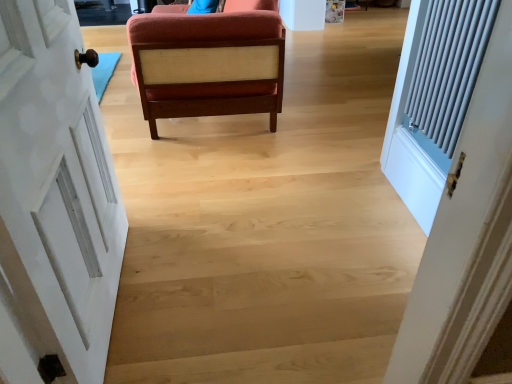
Question: Considering the relative sizes of velvet orange chair at center and white painted wood door at left in the image provided, is velvet orange chair at center thinner than white painted wood door at left?

Choices:
 (A) no
 (B) yes

Answer: (A)

Question: Considering the relative sizes of velvet orange chair at center and white painted wood door at left in the image provided, is velvet orange chair at center shorter than white painted wood door at left?

Choices:
 (A) no
 (B) yes

Answer: (B)

Question: From a real-world perspective, is velvet orange chair at center located higher than white painted wood door at left?

Choices:
 (A) no
 (B) yes

Answer: (A)

Question: Does velvet orange chair at center appear on the right side of white painted wood door at left?

Choices:
 (A) no
 (B) yes

Answer: (B)

Question: Are velvet orange chair at center and white painted wood door at left located far from each other?

Choices:
 (A) yes
 (B) no

Answer: (B)

Question: Does velvet orange chair at center lie in front of white painted wood door at left?

Choices:
 (A) yes
 (B) no

Answer: (B)

Question: From a real-world perspective, is white painted wood door at left physically above velvet orange chair at center?

Choices:
 (A) yes
 (B) no

Answer: (A)

Question: From a real-world perspective, is white painted wood door at left under velvet orange chair at center?

Choices:
 (A) yes
 (B) no

Answer: (B)

Question: Would you say white painted wood door at left contains velvet orange chair at center?

Choices:
 (A) no
 (B) yes

Answer: (A)

Question: Is white painted wood door at left with velvet orange chair at center?

Choices:
 (A) no
 (B) yes

Answer: (A)

Question: Considering the relative sizes of white painted wood door at left and velvet orange chair at center in the image provided, is white painted wood door at left shorter than velvet orange chair at center?

Choices:
 (A) yes
 (B) no

Answer: (B)

Question: Does white painted wood door at left appear on the right side of velvet orange chair at center?

Choices:
 (A) no
 (B) yes

Answer: (A)

Question: From a real-world perspective, is white painted wood door at left positioned above or below velvet orange chair at center?

Choices:
 (A) below
 (B) above

Answer: (B)